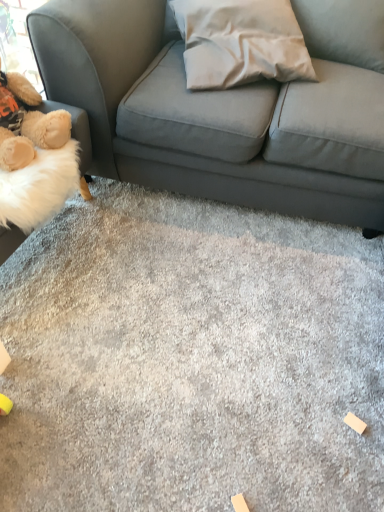
Question: From the image's perspective, is white fabric pillow at center located above or below gray carpet at center?

Choices:
 (A) below
 (B) above

Answer: (B)

Question: Is white fabric pillow at center taller or shorter than gray carpet at center?

Choices:
 (A) short
 (B) tall

Answer: (B)

Question: Which object is the closest to the gray carpet at center?

Choices:
 (A) white fabric pillow at center
 (B) fluffy beige teddy bear at left

Answer: (B)

Question: Estimate the real-world distances between objects in this image. Which object is farther from the fluffy beige teddy bear at left?

Choices:
 (A) gray carpet at center
 (B) white fabric pillow at center

Answer: (A)